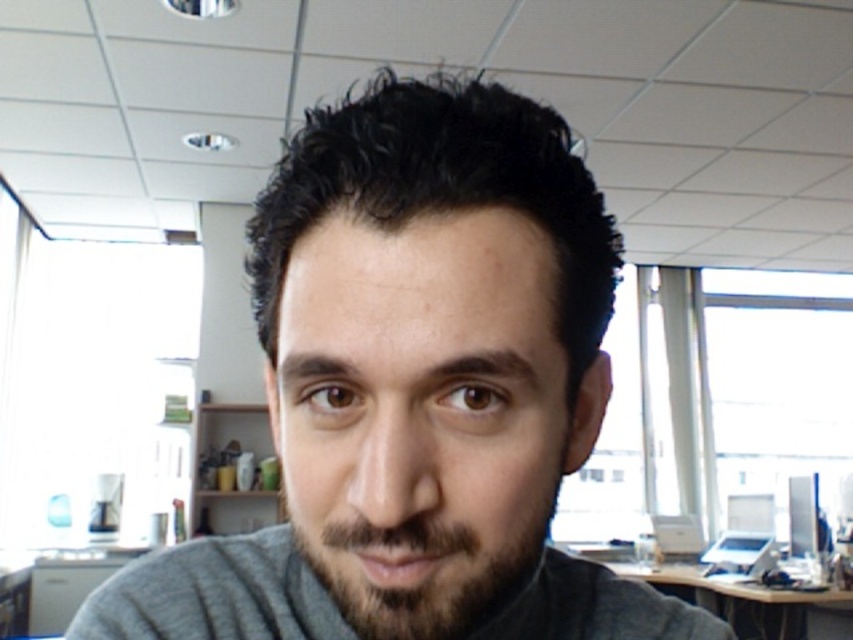
Question: Among these objects, which one is nearest to the camera?

Choices:
 (A) gray matte shirt at center
 (B) wooden desk at lower right
 (C) graymaterial/textureshirt at center

Answer: (A)

Question: Which point is closer to the camera?

Choices:
 (A) dark brown fuzzy beard at center
 (B) gray matte shirt at center
 (C) graymaterial/textureshirt at center
 (D) wooden desk at lower right

Answer: (A)

Question: Can you confirm if gray matte shirt at center is thinner than wooden desk at lower right?

Choices:
 (A) no
 (B) yes

Answer: (B)

Question: Estimate the real-world distances between objects in this image. Which object is closer to the wooden desk at lower right?

Choices:
 (A) dark brown fuzzy beard at center
 (B) graymaterial/textureshirt at center
 (C) gray matte shirt at center

Answer: (C)

Question: Is graymaterial/textureshirt at center positioned before dark brown fuzzy beard at center?

Choices:
 (A) no
 (B) yes

Answer: (A)

Question: Does gray matte shirt at center have a lesser width compared to graymaterial/textureshirt at center?

Choices:
 (A) yes
 (B) no

Answer: (A)